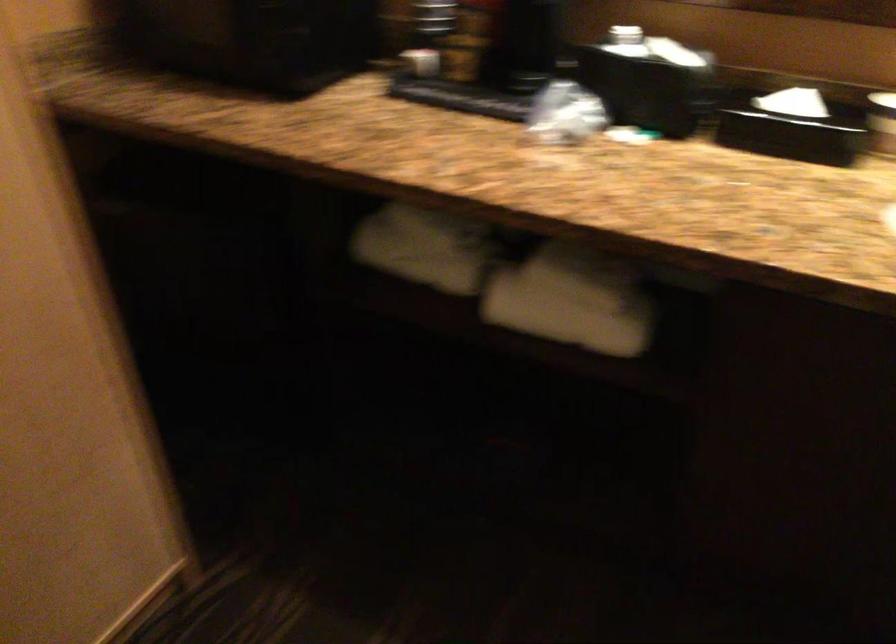
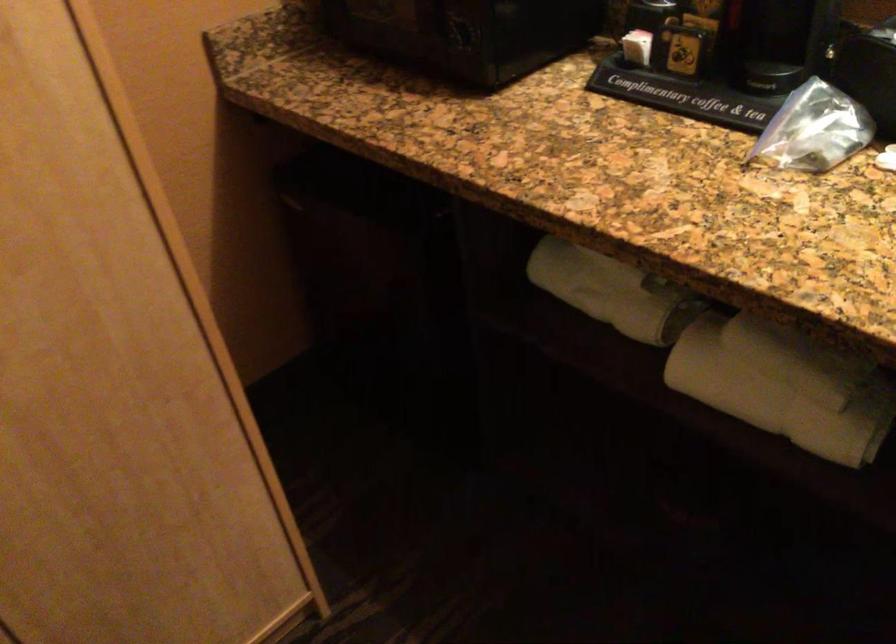
Find the pixel in the second image that matches point 414,257 in the first image.

(596, 290)